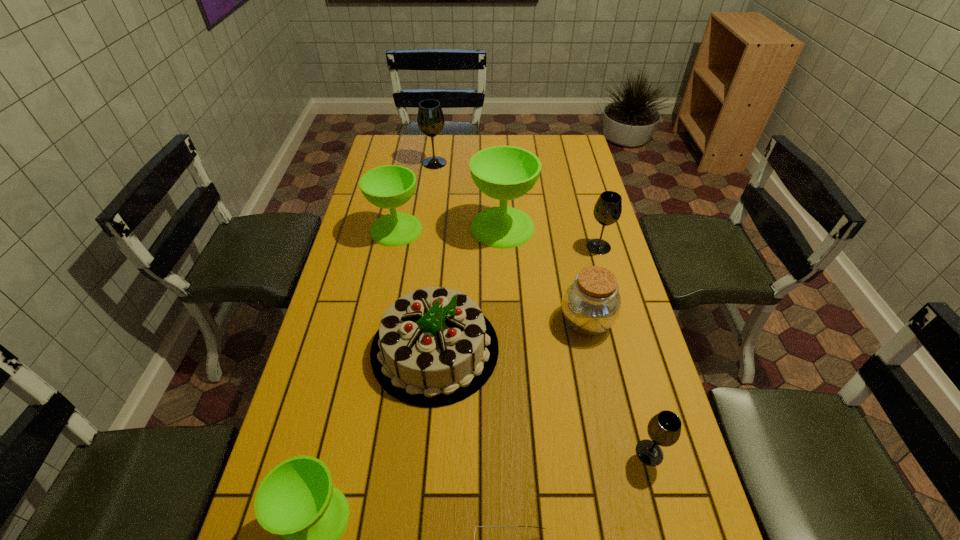
This screenshot has width=960, height=540. In order to click on free spot located 0.160m on the right of the biggest green wineglass in this screenshot , I will do `click(580, 227)`.

Where is `vacant space located on the right of the biggest gray wineglass`? This screenshot has height=540, width=960. vacant space located on the right of the biggest gray wineglass is located at coordinates (502, 163).

Where is `vacant point located 0.240m on the back of the green birthday cake`? This screenshot has height=540, width=960. vacant point located 0.240m on the back of the green birthday cake is located at coordinates 444,247.

At what (x,y) coordinates should I click in order to perform the action: click on free space located 0.050m on the back of the second farthest gray wineglass. Please return your answer as a coordinate pair (x, y). Looking at the image, I should click on (593, 229).

This screenshot has height=540, width=960. What are the coordinates of `vacant space situated on the front of the second smallest green wineglass` in the screenshot? It's located at (378, 316).

The image size is (960, 540). In order to click on blank space located on the front of the brown jar in this screenshot , I will do `click(612, 444)`.

At what (x,y) coordinates should I click in order to perform the action: click on vacant space located 0.180m on the back of the smallest gray wineglass. Please return your answer as a coordinate pair (x, y). Image resolution: width=960 pixels, height=540 pixels. Looking at the image, I should click on (628, 372).

Where is `object positioned at the far edge`? object positioned at the far edge is located at coordinates (430, 118).

Where is `birthday cake that is at the left edge`? This screenshot has width=960, height=540. birthday cake that is at the left edge is located at coordinates (434, 347).

You are a GUI agent. You are given a task and a screenshot of the screen. Output one action in this format:
    pyautogui.click(x=<x>, y=<y>)
    Task: Click on the wineglass at the left edge
    
    Given the screenshot: What is the action you would take?
    pyautogui.click(x=390, y=186)